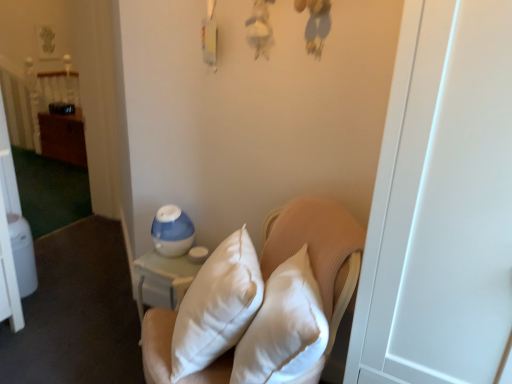
Question: Is point (52, 76) closer or farther from the camera than point (323, 236)?

Choices:
 (A) closer
 (B) farther

Answer: (B)

Question: In the image, is wooden bed at left on the left side or the right side of white quilted pillows at center?

Choices:
 (A) right
 (B) left

Answer: (B)

Question: Which object is positioned farthest from the white quilted pillows at center?

Choices:
 (A) wooden bed at left
 (B) wooden dresser at left

Answer: (A)

Question: Which of these objects is positioned closest to the white quilted pillows at center?

Choices:
 (A) wooden dresser at left
 (B) wooden bed at left

Answer: (A)